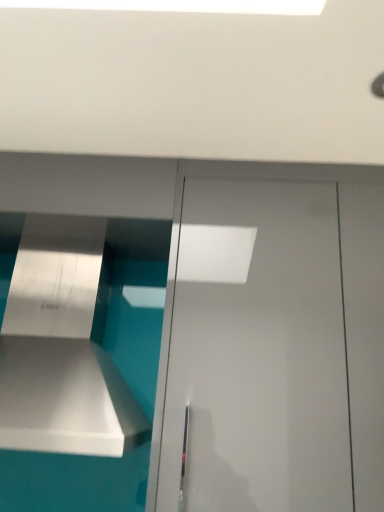
Question: Relative to white glossy door at center, is metallic silver vent at left in front or behind?

Choices:
 (A) front
 (B) behind

Answer: (A)

Question: From a real-world perspective, is metallic silver vent at left above or below white glossy door at center?

Choices:
 (A) below
 (B) above

Answer: (A)

Question: Is point (26, 265) closer or farther from the camera than point (231, 189)?

Choices:
 (A) farther
 (B) closer

Answer: (A)

Question: Is white glossy door at center to the left or to the right of metallic silver vent at left in the image?

Choices:
 (A) left
 (B) right

Answer: (B)

Question: Is white glossy door at center taller or shorter than metallic silver vent at left?

Choices:
 (A) tall
 (B) short

Answer: (A)

Question: Looking at their shapes, would you say white glossy door at center is wider or thinner than metallic silver vent at left?

Choices:
 (A) thin
 (B) wide

Answer: (A)

Question: From the image's perspective, is white glossy door at center above or below metallic silver vent at left?

Choices:
 (A) below
 (B) above

Answer: (A)